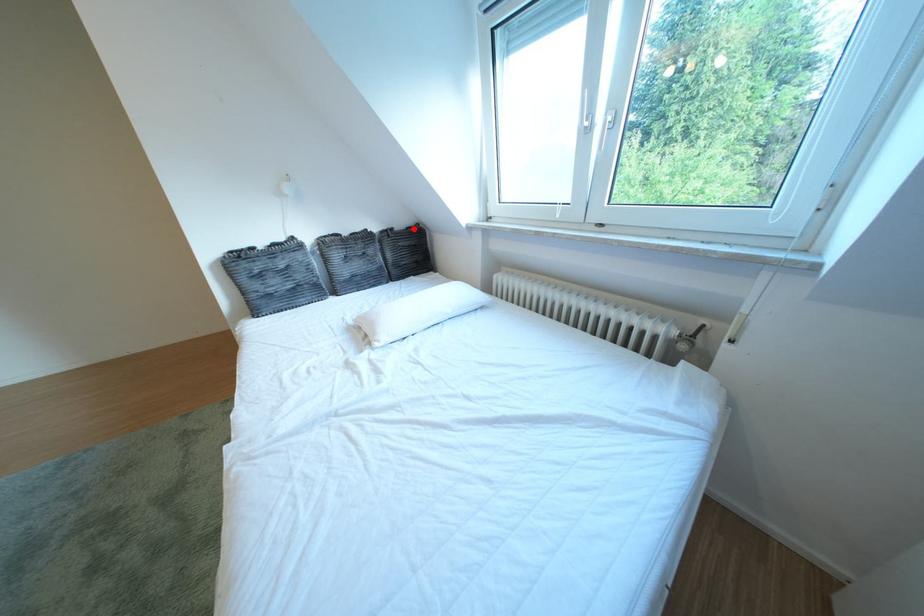
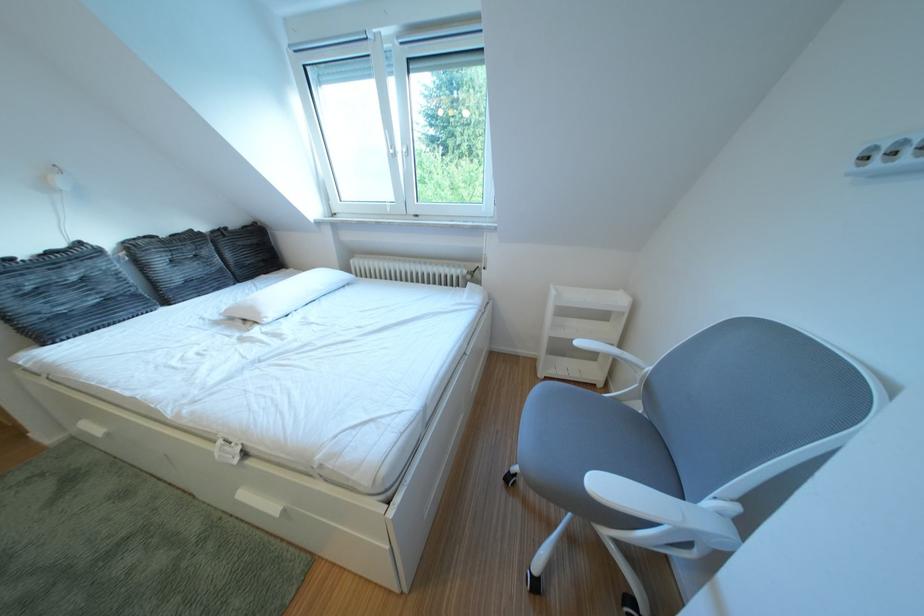
The point at the highlighted location is marked in the first image. Where is the corresponding point in the second image?

(247, 228)